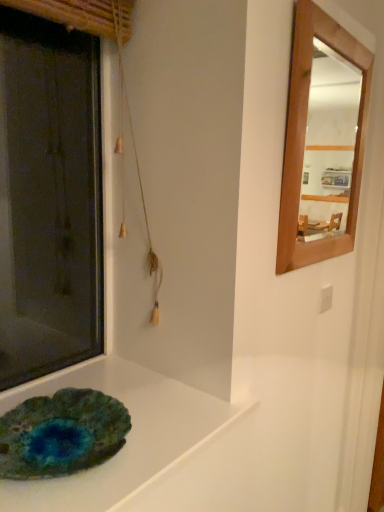
Question: Can you see teal agate plate at lower left touching matte stone slab at lower left?

Choices:
 (A) no
 (B) yes

Answer: (B)

Question: Is teal agate plate at lower left closer to camera compared to matte stone slab at lower left?

Choices:
 (A) yes
 (B) no

Answer: (B)

Question: Considering the relative positions of teal agate plate at lower left and matte stone slab at lower left in the image provided, is teal agate plate at lower left to the left of matte stone slab at lower left from the viewer's perspective?

Choices:
 (A) no
 (B) yes

Answer: (B)

Question: Is teal agate plate at lower left thinner than matte stone slab at lower left?

Choices:
 (A) yes
 (B) no

Answer: (A)

Question: Is teal agate plate at lower left oriented away from matte stone slab at lower left?

Choices:
 (A) yes
 (B) no

Answer: (B)

Question: Could matte stone slab at lower left be considered to be inside teal agate plate at lower left?

Choices:
 (A) no
 (B) yes

Answer: (A)

Question: Does matte stone slab at lower left have a larger size compared to teal agate plate at lower left?

Choices:
 (A) no
 (B) yes

Answer: (B)

Question: Can you confirm if matte stone slab at lower left is positioned to the right of teal agate plate at lower left?

Choices:
 (A) no
 (B) yes

Answer: (B)

Question: Does matte stone slab at lower left come behind teal agate plate at lower left?

Choices:
 (A) no
 (B) yes

Answer: (A)

Question: From a real-world perspective, is matte stone slab at lower left under teal agate plate at lower left?

Choices:
 (A) yes
 (B) no

Answer: (A)

Question: Does matte stone slab at lower left have a smaller size compared to teal agate plate at lower left?

Choices:
 (A) yes
 (B) no

Answer: (B)

Question: Is matte stone slab at lower left turned away from teal agate plate at lower left?

Choices:
 (A) no
 (B) yes

Answer: (A)

Question: Is matte stone slab at lower left bigger or smaller than teal agate plate at lower left?

Choices:
 (A) big
 (B) small

Answer: (A)